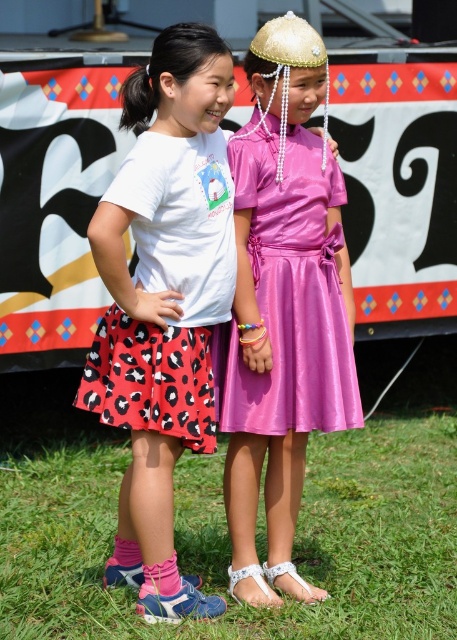
You are a photographer planning to capture a photo of the two girls. You want to ensure that both the red polka dot skirt at center and the shiny pink dress at center are fully visible in the frame. Given that the camera has a fixed focus, which girl should you position closer to the camera to avoid cropping either outfit?

You should position the girl wearing the red polka dot skirt at center closer to the camera because its width is larger than the shiny pink dress at center. This ensures both outfits are fully visible without cropping.